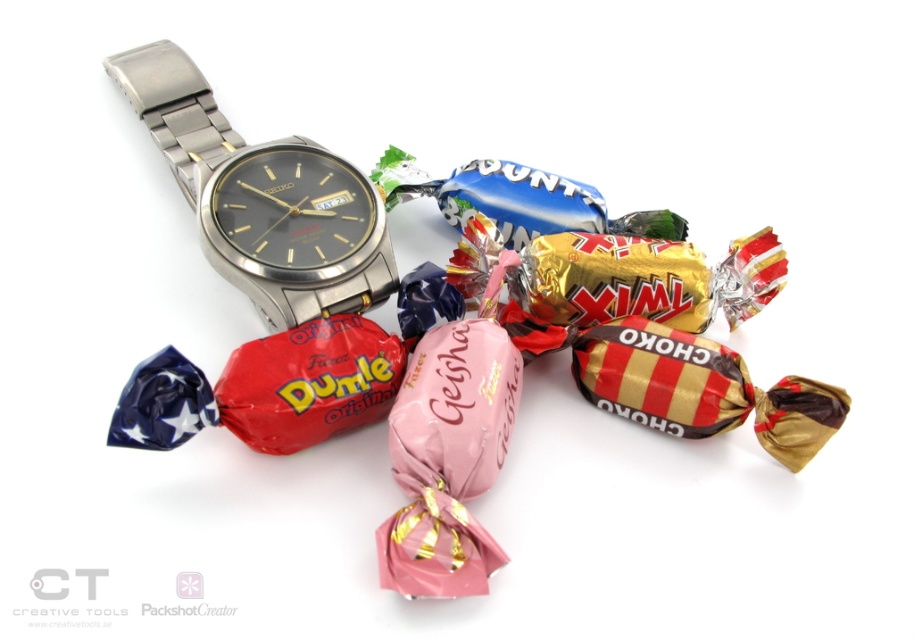
You are organizing a gift box and need to place the satin silver watch at upper left and the metallic watch at center. According to the arrangement in the image, which watch should be placed on the left side of the box?

The satin silver watch at upper left should be placed on the left side of the box because it is positioned to the left of the metallic watch at center in the image.

You are a jeweler inspecting a display of candies and watches. You notice the satin silver watch at upper left and the metallic watch at center. Which watch is placed higher up in the image?

The satin silver watch at upper left is placed higher up because it is positioned over the metallic watch at center.

You are trying to decide which watch to choose between the satin silver watch at upper left and the metallic watch at center. Based on their positions, which one appears nearer to you?

The satin silver watch at upper left is closer to the viewer than the metallic watch at center, so it appears nearer.